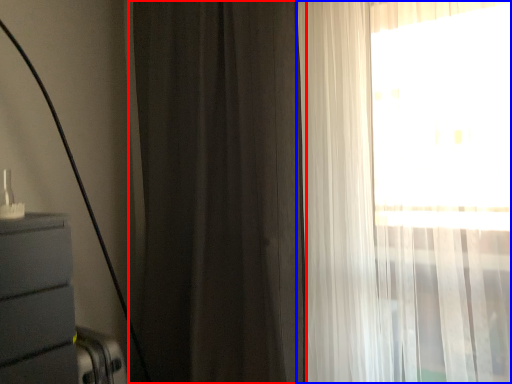
Question: Which object is further to the camera taking this photo, curtain (highlighted by a red box) or curtain (highlighted by a blue box)?

Choices:
 (A) curtain
 (B) curtain

Answer: (A)